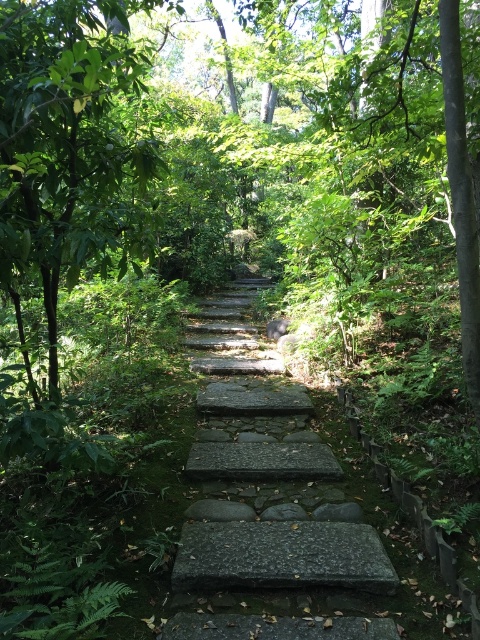
Question: Which of the following is the farthest from the observer?

Choices:
 (A) gray stone stairs at center
 (B) granite stone at center
 (C) green leafy tree at center

Answer: (B)

Question: Is gray stone stairs at center smaller than granite stone at center?

Choices:
 (A) no
 (B) yes

Answer: (A)

Question: Which of the following is the closest to the observer?

Choices:
 (A) green leafy tree at center
 (B) gray stone stairs at center

Answer: (A)

Question: Can you confirm if green leafy tree at center is positioned to the right of granite stone at center?

Choices:
 (A) no
 (B) yes

Answer: (A)

Question: In this image, where is green leafy tree at center located relative to granite stone at center?

Choices:
 (A) above
 (B) below

Answer: (A)

Question: Which object appears farthest from the camera in this image?

Choices:
 (A) gray stone stairs at center
 (B) granite stone at center
 (C) green leafy tree at center

Answer: (B)